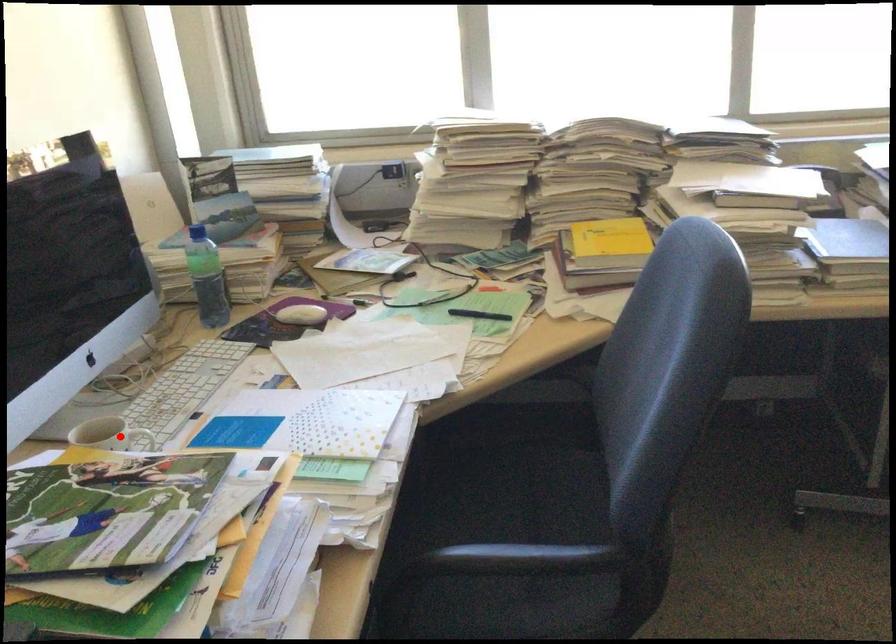
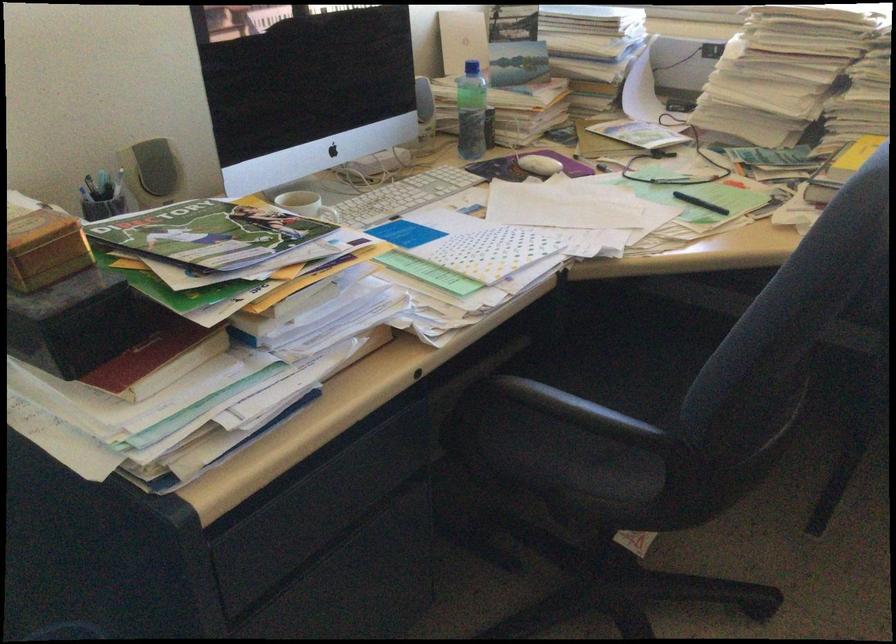
Question: I am providing you with two images of the same scene from different viewpoints. Given a red point in image1, look at the same physical point in image2. Is it:

Choices:
 (A) Closer to the viewpoint
 (B) Farther from the viewpoint

Answer: (B)